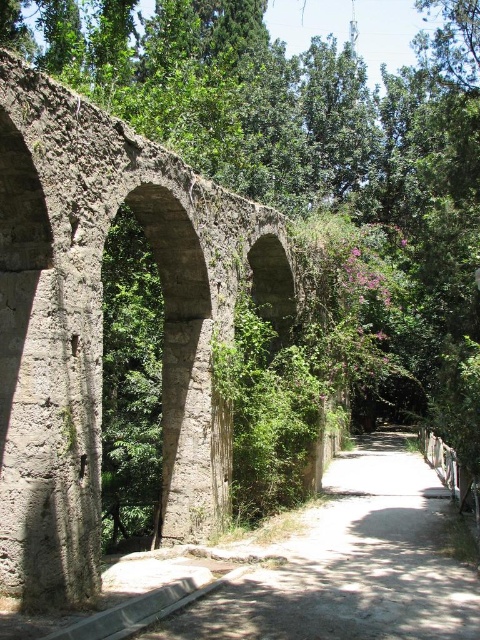
You are standing on the dirt path at center and want to cross over the rusty concrete arch bridge at center. Which direction should you walk to reach the bridge first?

The rusty concrete arch bridge at center is further to the viewer than the dirt path at center, so you should walk forward towards the bridge since it is closer to you than the dirt path.

Consider the image. You are a hiker planning to cross the rusty concrete arch bridge at center. The dirt path at center is narrow. Will the bridge be wide enough for you to walk across comfortably?

The rusty concrete arch bridge at center has a larger size compared to dirt path at center, so the bridge is wider than the path. Since the path is narrow, the bridge should provide enough width for comfortable walking.

You are a hiker who wants to know if your 2m tall tent can fit under the rusty concrete arch bridge at center while staying on the dirt path at center. Can it?

The rusty concrete arch bridge at center is much taller than the dirt path at center. Since the bridge is taller, there is sufficient clearance for a 2m tall tent to pass underneath while staying on the dirt path at center.